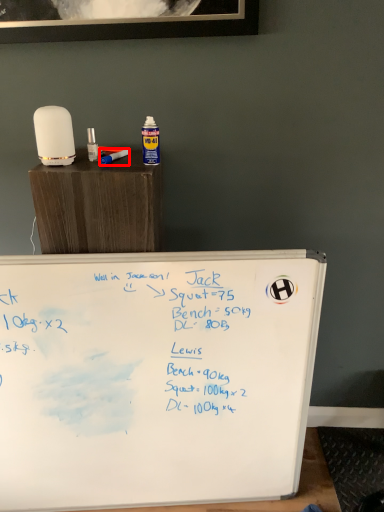
Question: From the image's perspective, what is the correct spatial positioning of paint brush (annotated by the red box) in reference to table?

Choices:
 (A) below
 (B) above

Answer: (B)